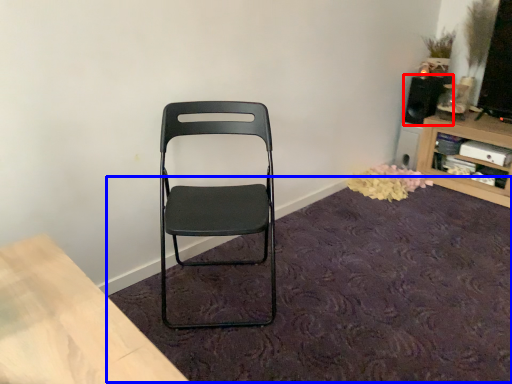
Question: Which object appears farthest to the camera in this image, speaker (highlighted by a red box) or mat (highlighted by a blue box)?

Choices:
 (A) speaker
 (B) mat

Answer: (A)